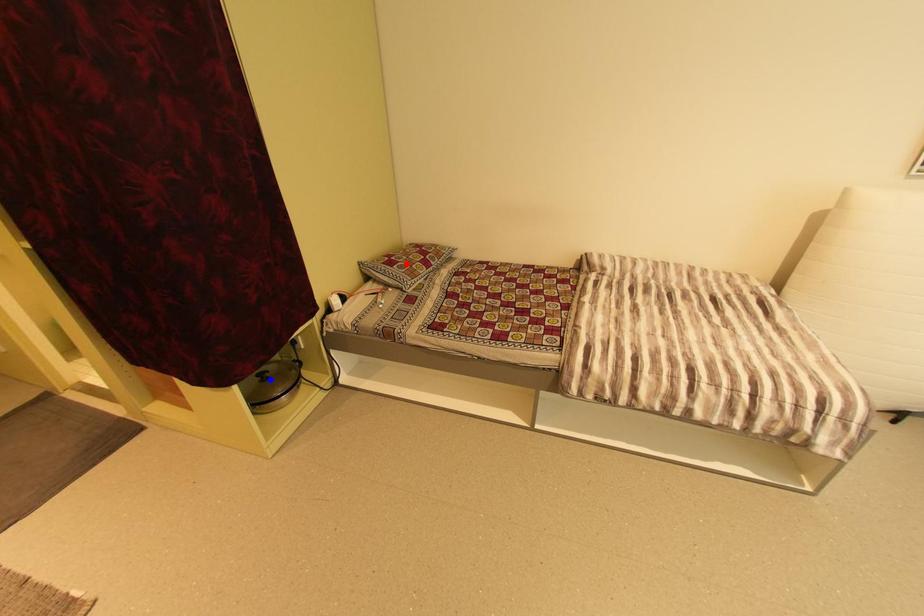
Question: In the image, two points are highlighted. Which point is nearer to the camera? Reply with the corresponding letter.

Choices:
 (A) blue point
 (B) red point

Answer: (A)